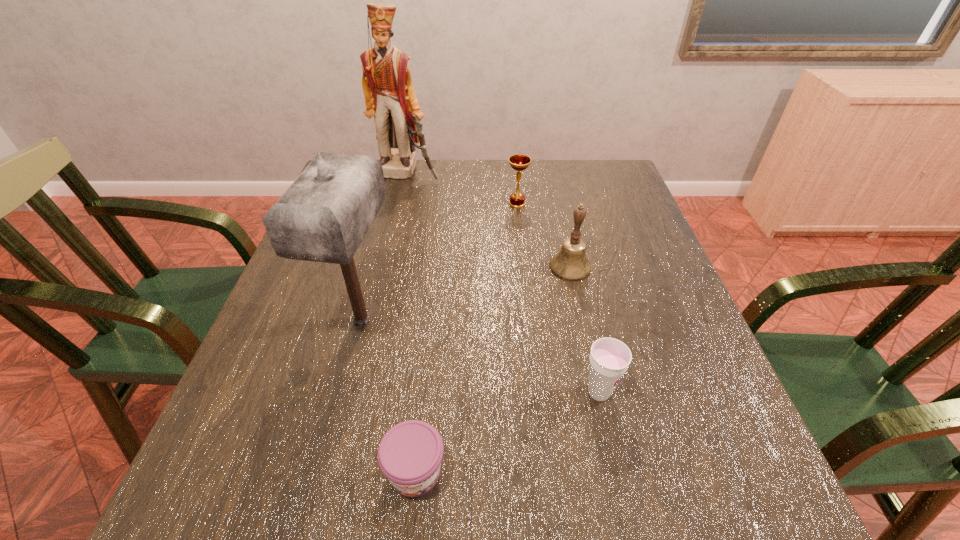
Identify the location of nutcracker. (389, 94).

The width and height of the screenshot is (960, 540). What are the coordinates of `the tallest object` in the screenshot? It's located at (389, 94).

The width and height of the screenshot is (960, 540). I want to click on mallet, so click(x=323, y=216).

Where is `the fifth shortest object`? The image size is (960, 540). the fifth shortest object is located at coordinates (x=323, y=216).

This screenshot has width=960, height=540. I want to click on the fourth nearest object, so click(x=571, y=264).

Locate an element on the screen. The image size is (960, 540). the third tallest object is located at coordinates (571, 264).

Image resolution: width=960 pixels, height=540 pixels. What are the coordinates of `the fifth nearest object` in the screenshot? It's located at (519, 162).

You are a GUI agent. You are given a task and a screenshot of the screen. Output one action in this format:
    pyautogui.click(x=<x>, y=<y>)
    Task: Click on the third object from right to left
    
    Given the screenshot: What is the action you would take?
    pyautogui.click(x=519, y=162)

This screenshot has height=540, width=960. I want to click on cup, so click(x=609, y=359).

Where is `the fifth tallest object`? the fifth tallest object is located at coordinates (609, 359).